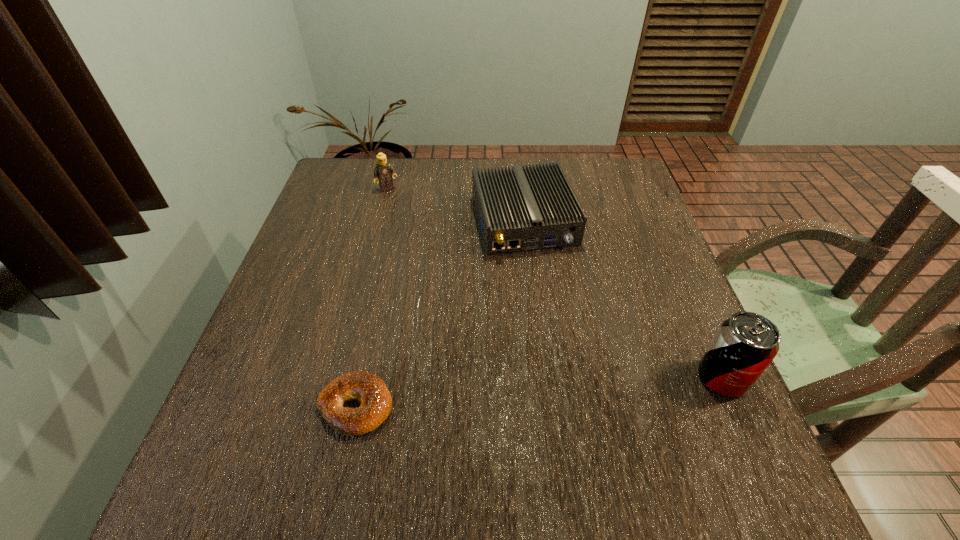
Image resolution: width=960 pixels, height=540 pixels. Find the location of `vacant spot on the desktop that is between the bagel and the tallest object and is positioned on the back panel of the third object from left to right`. vacant spot on the desktop that is between the bagel and the tallest object and is positioned on the back panel of the third object from left to right is located at coordinates (584, 389).

I want to click on free space on the desktop that is between the bagel and the rightmost object and is positioned in front of the Lego, so click(x=524, y=393).